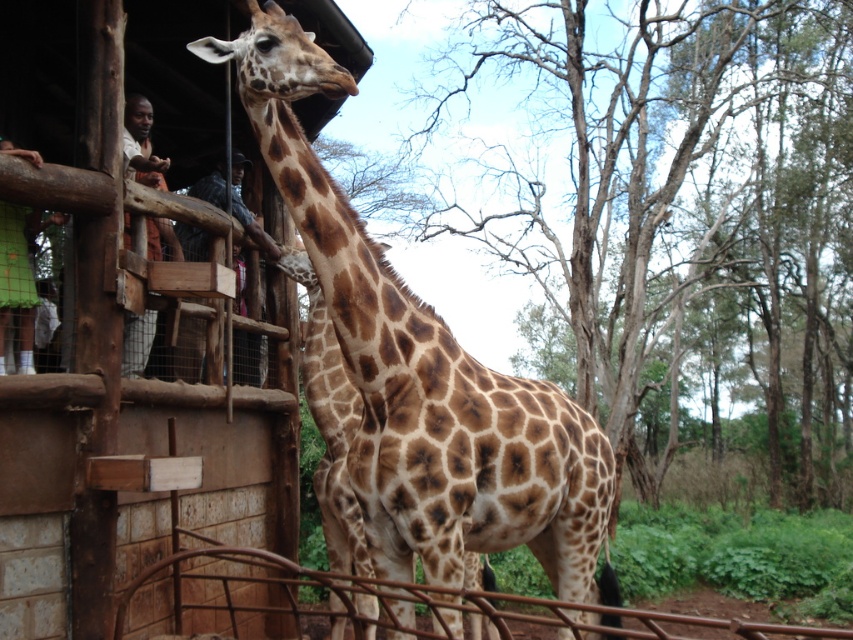
What do you see at coordinates (421, 369) in the screenshot? This screenshot has width=853, height=640. I see `brown spotted giraffe at center` at bounding box center [421, 369].

Who is more distant from viewer, (253, 1) or (358, 604)?

Positioned behind is point (358, 604).

What are the coordinates of `brown spotted giraffe at center` in the screenshot? It's located at (421, 369).

Can you confirm if brown spotted giraffe at center is positioned to the right of light brown wood at left?

Yes, brown spotted giraffe at center is to the right of light brown wood at left.

The width and height of the screenshot is (853, 640). What do you see at coordinates (421, 369) in the screenshot?
I see `brown spotted giraffe at center` at bounding box center [421, 369].

The width and height of the screenshot is (853, 640). In order to click on brown spotted giraffe at center in this screenshot , I will do `click(421, 369)`.

Which is in front, point (366, 563) or point (131, 131)?

Point (366, 563)

Looking at this image, is brown spotted fur at center further to camera compared to light brown wood at left?

Yes, it is behind light brown wood at left.

Where is `brown spotted fur at center`? The image size is (853, 640). brown spotted fur at center is located at coordinates (329, 424).